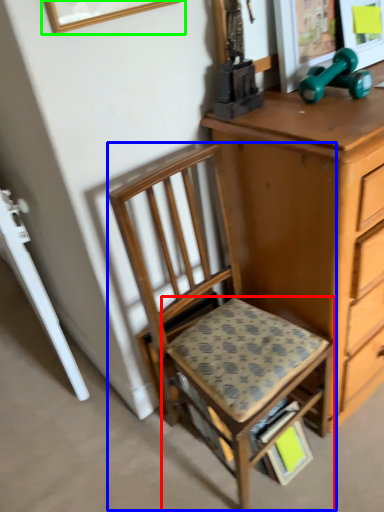
Question: Considering the real-world distances, which object is farthest from step stool (highlighted by a red box)? chair (highlighted by a blue box) or picture frame (highlighted by a green box)?

Choices:
 (A) chair
 (B) picture frame

Answer: (B)